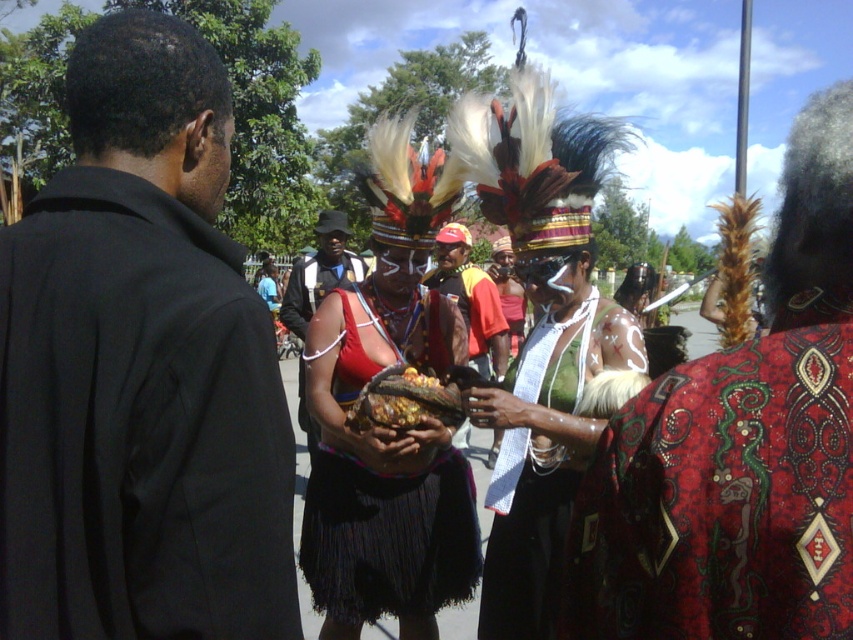
Question: Where is black matte suit at left located in relation to red textured cloth at center in the image?

Choices:
 (A) right
 (B) left

Answer: (B)

Question: Which point is closer to the camera?

Choices:
 (A) (386, 392)
 (B) (393, 307)

Answer: (A)

Question: Estimate the real-world distances between objects in this image. Which object is farther from the shiny metallic bowl at center?

Choices:
 (A) matte red shirt at center
 (B) black matte suit at left
 (C) red textured cloth at center
 (D) matte red fabric at center

Answer: (D)

Question: Does black matte suit at left have a greater width compared to black fringed skirt at center?

Choices:
 (A) yes
 (B) no

Answer: (B)

Question: Which point is farther from the camera taking this photo?

Choices:
 (A) (113, 445)
 (B) (469, 260)
 (C) (399, 490)

Answer: (B)

Question: Does red textured cloth at center appear over black fringed skirt at center?

Choices:
 (A) no
 (B) yes

Answer: (B)